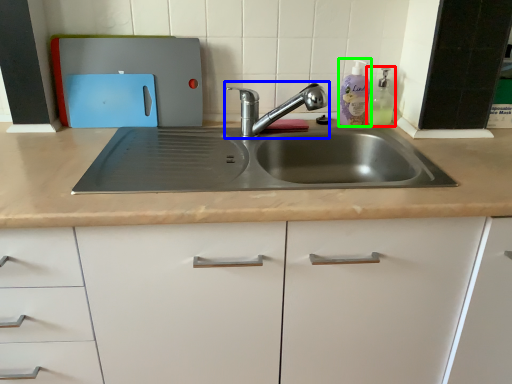
Question: Considering the real-world distances, which object is closest to soap dispenser (highlighted by a red box)? tap (highlighted by a blue box) or cleaning product (highlighted by a green box).

Choices:
 (A) tap
 (B) cleaning product

Answer: (B)